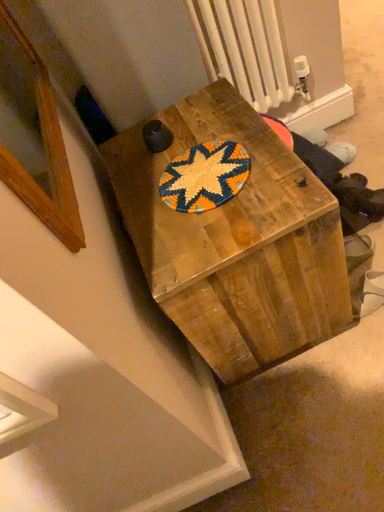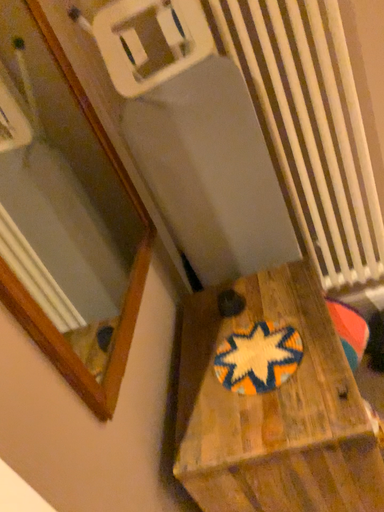
Question: Which way did the camera rotate in the video?

Choices:
 (A) rotated downward
 (B) rotated upward

Answer: (B)